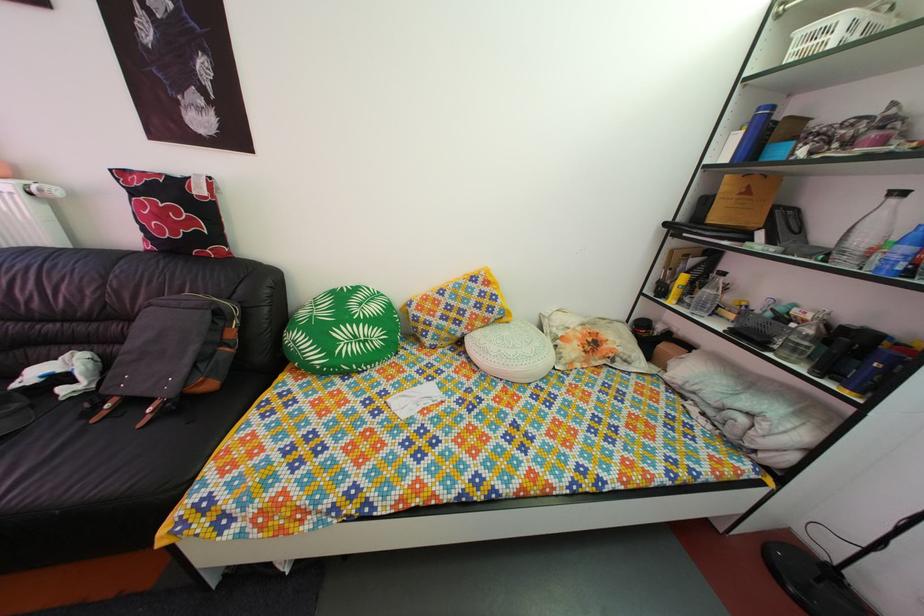
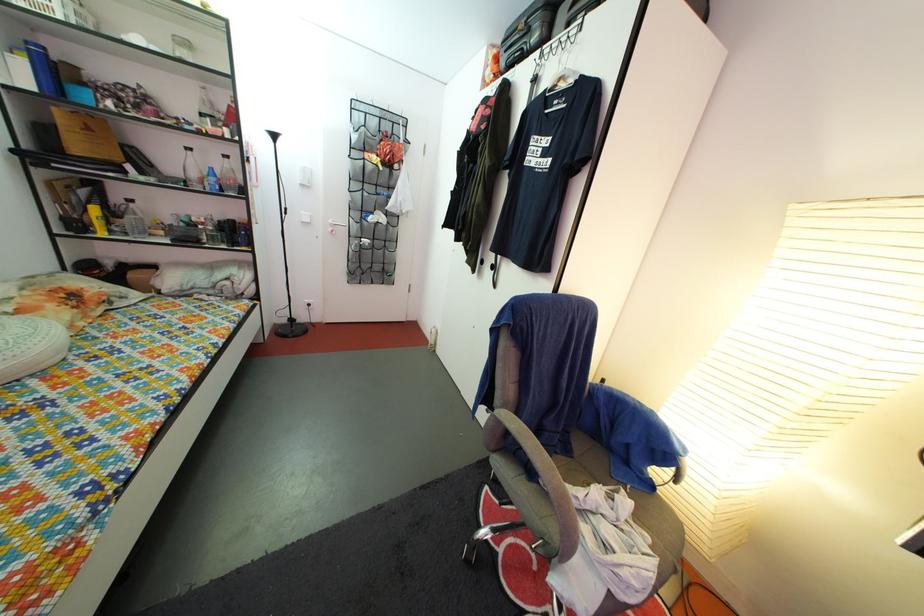
Find the pixel in the second image that matches pixel 768 118 in the first image.

(37, 51)